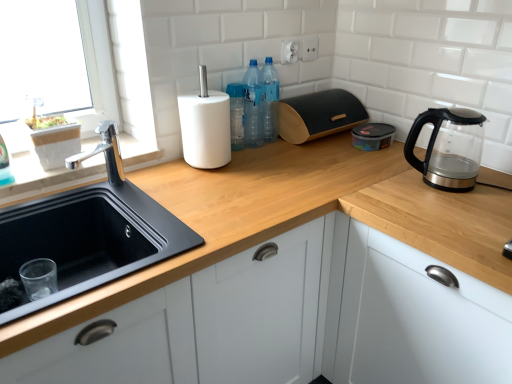
I want to click on vacant region in front of translucent plastic bottles at center, acting as the first bottle starting from the left, so 265,153.